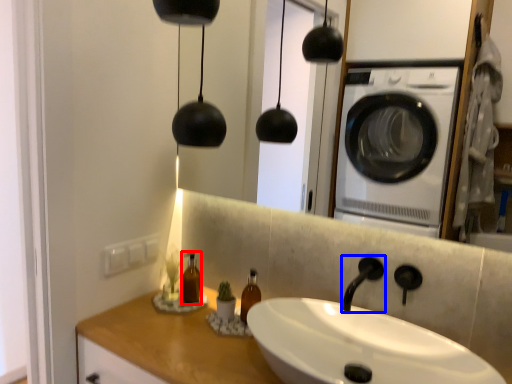
Question: Which object is further to the camera taking this photo, bottle (highlighted by a red box) or faucet (highlighted by a blue box)?

Choices:
 (A) bottle
 (B) faucet

Answer: (A)